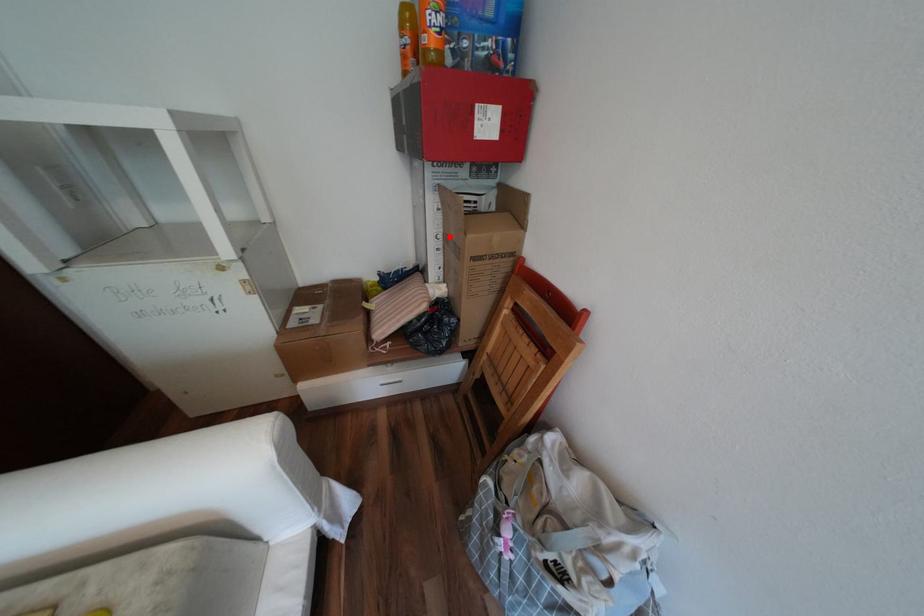
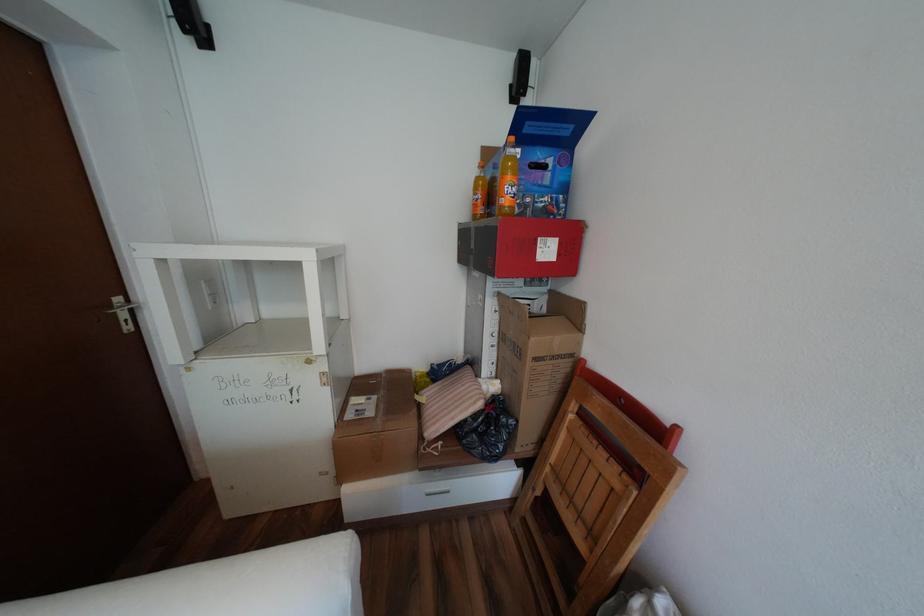
Locate, in the second image, the point that corresponds to the highlighted location in the first image.

(505, 334)